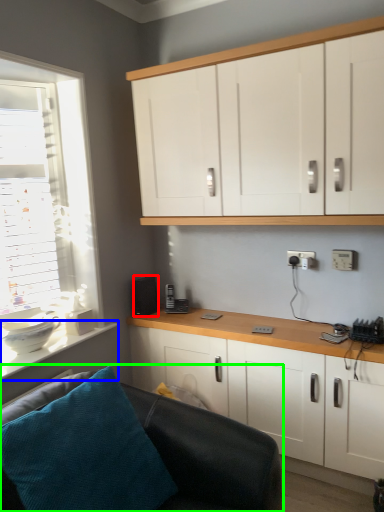
Question: Which is farther away from speaker (highlighted by a red box)? counter top (highlighted by a blue box) or studio couch (highlighted by a green box)?

Choices:
 (A) counter top
 (B) studio couch

Answer: (B)